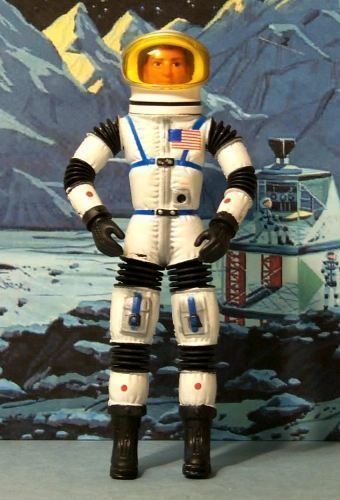
This screenshot has height=500, width=340. I want to click on floor, so click(252, 479).